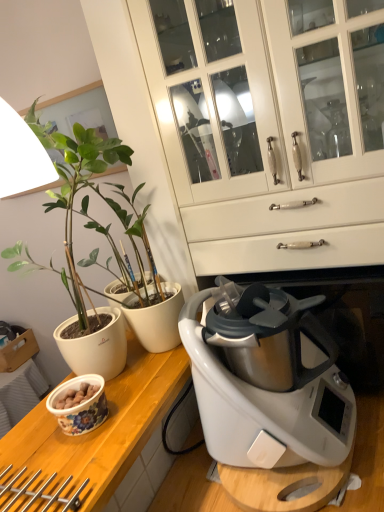
Question: Does matte white pot at left have a lesser width compared to floral ceramic bowl at lower left?

Choices:
 (A) no
 (B) yes

Answer: (A)

Question: From a real-world perspective, is matte white pot at left located higher than floral ceramic bowl at lower left?

Choices:
 (A) no
 (B) yes

Answer: (B)

Question: From a real-world perspective, does matte white pot at left sit lower than floral ceramic bowl at lower left?

Choices:
 (A) yes
 (B) no

Answer: (B)

Question: Does matte white pot at left have a lesser height compared to floral ceramic bowl at lower left?

Choices:
 (A) no
 (B) yes

Answer: (A)

Question: Does matte white pot at left appear on the right side of floral ceramic bowl at lower left?

Choices:
 (A) yes
 (B) no

Answer: (A)

Question: Is point (187, 358) positioned closer to the camera than point (66, 303)?

Choices:
 (A) closer
 (B) farther

Answer: (A)

Question: Is floral ceramic bowl at lower left wider or thinner than matte white pot at left?

Choices:
 (A) wide
 (B) thin

Answer: (B)

Question: From a real-world perspective, is floral ceramic bowl at lower left physically located above or below matte white pot at left?

Choices:
 (A) above
 (B) below

Answer: (B)

Question: Is floral ceramic bowl at lower left to the left or to the right of matte white pot at left in the image?

Choices:
 (A) right
 (B) left

Answer: (B)

Question: Is white glossy cabinet at center wider or thinner than matte white pot at left?

Choices:
 (A) thin
 (B) wide

Answer: (B)

Question: From the image's perspective, is white glossy cabinet at center positioned above or below matte white pot at left?

Choices:
 (A) above
 (B) below

Answer: (A)

Question: Is white glossy cabinet at center in front of or behind matte white pot at left in the image?

Choices:
 (A) behind
 (B) front

Answer: (A)

Question: Visually, is white glossy cabinet at center positioned to the left or to the right of matte white pot at left?

Choices:
 (A) left
 (B) right

Answer: (B)

Question: From the image's perspective, is wooden at left located above or below matte white pot at left?

Choices:
 (A) below
 (B) above

Answer: (A)

Question: Looking at the image, does wooden at left seem bigger or smaller compared to matte white pot at left?

Choices:
 (A) small
 (B) big

Answer: (B)